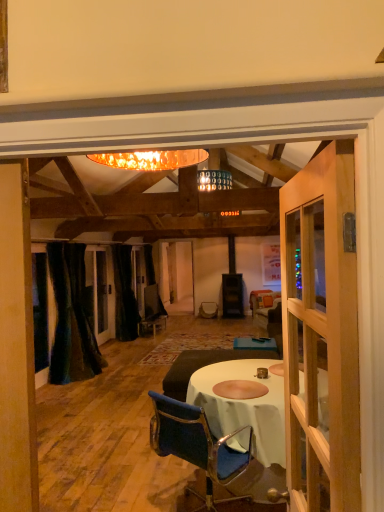
Describe the element at coordinates (321, 333) in the screenshot. The width and height of the screenshot is (384, 512). I see `wooden door at right` at that location.

How much space does velvet dark green curtain at left, which is the 2th curtain in back-to-front order, occupy horizontally?

The width of velvet dark green curtain at left, which is the 2th curtain in back-to-front order, is 21.70 inches.

In the scene shown: What is the approximate height of velvet dark green curtain at left, marked as the 1th curtain in a front-to-back arrangement?

6.18 feet.

Where is `velvet dark brown couch at center`? velvet dark brown couch at center is located at coordinates (203, 366).

The image size is (384, 512). In order to click on velvet blue chair at center in this screenshot , I will do `click(197, 445)`.

Find the location of a particular element. The height and width of the screenshot is (512, 384). black velvet curtain at center, which ranks as the first curtain in back-to-front order is located at coordinates (124, 294).

Is black velvet curtain at center, which ranks as the first curtain in back-to-front order, situated inside velvet dark green curtain at left, marked as the 1th curtain in a front-to-back arrangement, or outside?

black velvet curtain at center, which ranks as the first curtain in back-to-front order, lies outside velvet dark green curtain at left, marked as the 1th curtain in a front-to-back arrangement.

Looking at their sizes, would you say black velvet curtain at center, which ranks as the first curtain in back-to-front order, is wider or thinner than velvet dark green curtain at left, marked as the 1th curtain in a front-to-back arrangement?

Considering their sizes, black velvet curtain at center, which ranks as the first curtain in back-to-front order, looks slimmer than velvet dark green curtain at left, marked as the 1th curtain in a front-to-back arrangement.

Consider the image. Is black velvet curtain at center, which ranks as the first curtain in back-to-front order, aimed at velvet dark green curtain at left, marked as the 1th curtain in a front-to-back arrangement?

No, black velvet curtain at center, which ranks as the first curtain in back-to-front order, is not oriented towards velvet dark green curtain at left, marked as the 1th curtain in a front-to-back arrangement.

From the image's perspective, relative to velvet dark brown couch at center, is black velvet curtain at center, which ranks as the first curtain in back-to-front order, above or below?

From the image's perspective, black velvet curtain at center, which ranks as the first curtain in back-to-front order, appears above velvet dark brown couch at center.

Which point is more distant from viewer, (x=139, y=320) or (x=180, y=357)?

The point (x=139, y=320) is more distant.

Is black velvet curtain at center, which ranks as the first curtain in back-to-front order, far away from velvet dark brown couch at center?

black velvet curtain at center, which ranks as the first curtain in back-to-front order, is positioned a significant distance from velvet dark brown couch at center.

Between black velvet curtain at center, the 2th curtain in the front-to-back sequence, and velvet dark brown couch at center, which one appears on the right side from the viewer's perspective?

From the viewer's perspective, velvet dark brown couch at center appears more on the right side.

Between wooden door at right and velvet dark green curtain at left, marked as the 1th curtain in a front-to-back arrangement, which one has less height?

With less height is wooden door at right.

Which object is positioned more to the right, wooden door at right or velvet dark green curtain at left, marked as the 1th curtain in a front-to-back arrangement?

wooden door at right.

Consider the image. Is wooden door at right next to velvet dark green curtain at left, marked as the 1th curtain in a front-to-back arrangement?

wooden door at right and velvet dark green curtain at left, marked as the 1th curtain in a front-to-back arrangement, are not in contact.

From a real-world perspective, which is physically below, wooden door at right or velvet dark green curtain at left, marked as the 1th curtain in a front-to-back arrangement?

From a 3D spatial view, velvet dark green curtain at left, marked as the 1th curtain in a front-to-back arrangement, is below.

Considering the points (204, 468) and (97, 365), which point is behind, point (204, 468) or point (97, 365)?

Positioned behind is point (97, 365).

Is velvet blue chair at center situated inside velvet dark green curtain at left, marked as the 1th curtain in a front-to-back arrangement, or outside?

velvet blue chair at center cannot be found inside velvet dark green curtain at left, marked as the 1th curtain in a front-to-back arrangement.

Can you confirm if velvet blue chair at center is wider than velvet dark green curtain at left, which is the 2th curtain in back-to-front order?

Correct, the width of velvet blue chair at center exceeds that of velvet dark green curtain at left, which is the 2th curtain in back-to-front order.

Which is in front, point (297, 459) or point (234, 495)?

The point (297, 459) is closer.

There is a velvet blue chair at center. At what (x,y) coordinates should I click in order to perform the action: click on door above it (from a real-world perspective). Please return your answer as a coordinate pair (x, y). This screenshot has width=384, height=512. Looking at the image, I should click on (321, 333).

Is wooden door at right not close to velvet blue chair at center?

wooden door at right is far away from velvet blue chair at center.

Does velvet blue chair at center lie in front of wooden door at right?

No.

Which is farther, (178, 434) or (319, 281)?

The point (178, 434) is farther from the camera.

Considering the relative sizes of velvet blue chair at center and wooden door at right in the image provided, is velvet blue chair at center shorter than wooden door at right?

Yes.

Does point (307, 384) lie behind point (212, 356)?

That is False.

What are the coordinates of `door on the left side of velvet dark brown couch at center` in the screenshot? It's located at tap(321, 333).

Could you tell me if wooden door at right is facing velvet dark brown couch at center?

No, wooden door at right is not turned towards velvet dark brown couch at center.

Identify the location of curtain beneath the velvet dark green curtain at left, which is the 2th curtain in back-to-front order (from a real-world perspective). (124, 294).

From a real-world perspective, starting from the velvet dark brown couch at center, which curtain is the 1st one vertically above it? Please provide its 2D coordinates.

[(124, 294)]

Based on their spatial positions, is wooden door at right or velvet blue chair at center further from black velvet curtain at center, the 2th curtain in the front-to-back sequence?

wooden door at right is further to black velvet curtain at center, the 2th curtain in the front-to-back sequence.

Looking at the image, which one is located further to velvet dark brown couch at center, velvet dark green curtain at left, marked as the 1th curtain in a front-to-back arrangement, or wooden door at right?

wooden door at right lies further to velvet dark brown couch at center than the other object.

In the scene shown: Which object lies nearer to the anchor point velvet dark brown couch at center, black velvet curtain at center, which ranks as the first curtain in back-to-front order, or velvet dark green curtain at left, which is the 2th curtain in back-to-front order?

The object closer to velvet dark brown couch at center is velvet dark green curtain at left, which is the 2th curtain in back-to-front order.

Which object lies nearer to the anchor point velvet dark brown couch at center, velvet blue chair at center or velvet dark green curtain at left, which is the 2th curtain in back-to-front order?

velvet blue chair at center is positioned closer to the anchor velvet dark brown couch at center.

Looking at the image, which one is located closer to black velvet curtain at center, the 2th curtain in the front-to-back sequence, velvet dark brown couch at center or wooden door at right?

The object closer to black velvet curtain at center, the 2th curtain in the front-to-back sequence, is velvet dark brown couch at center.

When comparing their distances from black velvet curtain at center, the 2th curtain in the front-to-back sequence, does wooden door at right or velvet dark green curtain at left, which is the 2th curtain in back-to-front order, seem further?

wooden door at right lies further to black velvet curtain at center, the 2th curtain in the front-to-back sequence, than the other object.

Considering their positions, is black velvet curtain at center, which ranks as the first curtain in back-to-front order, positioned closer to velvet blue chair at center than wooden door at right?

The object closer to velvet blue chair at center is wooden door at right.

From the image, which object appears to be farther from velvet dark green curtain at left, marked as the 1th curtain in a front-to-back arrangement, velvet dark brown couch at center or wooden door at right?

wooden door at right.

Locate an element on the screen. chair positioned between wooden door at right and velvet dark brown couch at center from near to far is located at coordinates (197, 445).

Find the location of a particular element. The width and height of the screenshot is (384, 512). chair positioned between wooden door at right and velvet dark green curtain at left, which is the 2th curtain in back-to-front order, from near to far is located at coordinates (197, 445).

Find the location of `curtain between wooden door at right and black velvet curtain at center, the 2th curtain in the front-to-back sequence, in the front-back direction`. curtain between wooden door at right and black velvet curtain at center, the 2th curtain in the front-to-back sequence, in the front-back direction is located at coordinates (71, 317).

Image resolution: width=384 pixels, height=512 pixels. I want to click on studio couch between velvet blue chair at center and velvet dark green curtain at left, marked as the 1th curtain in a front-to-back arrangement, from front to back, so click(203, 366).